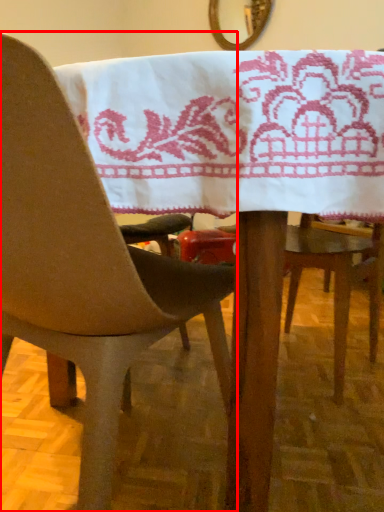
Question: From the image's perspective, what is the correct spatial positioning of chair (annotated by the red box) in reference to mirror?

Choices:
 (A) below
 (B) above

Answer: (A)